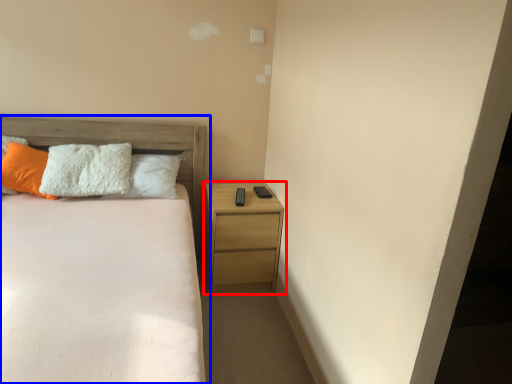
Question: Among these objects, which one is farthest to the camera, nightstand (highlighted by a red box) or bed (highlighted by a blue box)?

Choices:
 (A) nightstand
 (B) bed

Answer: (A)